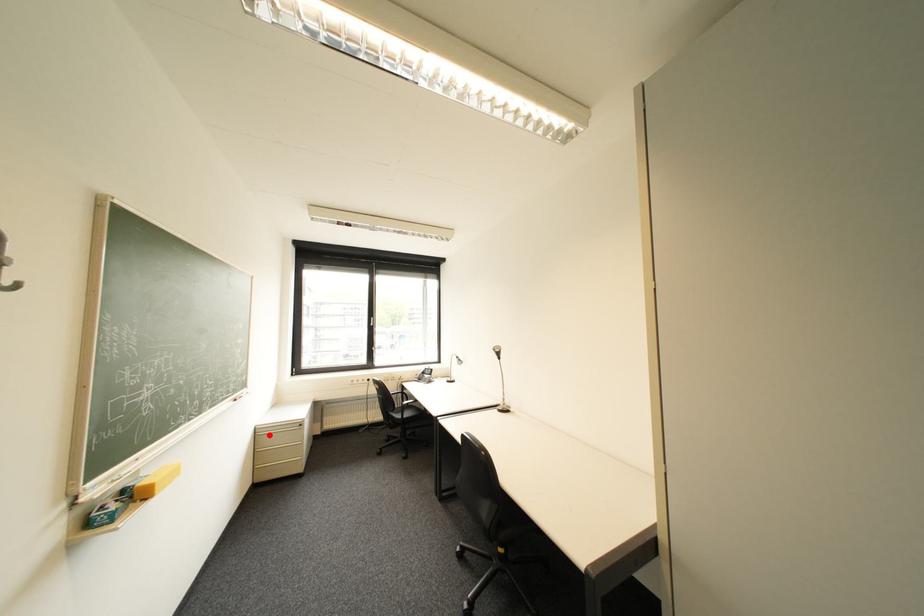
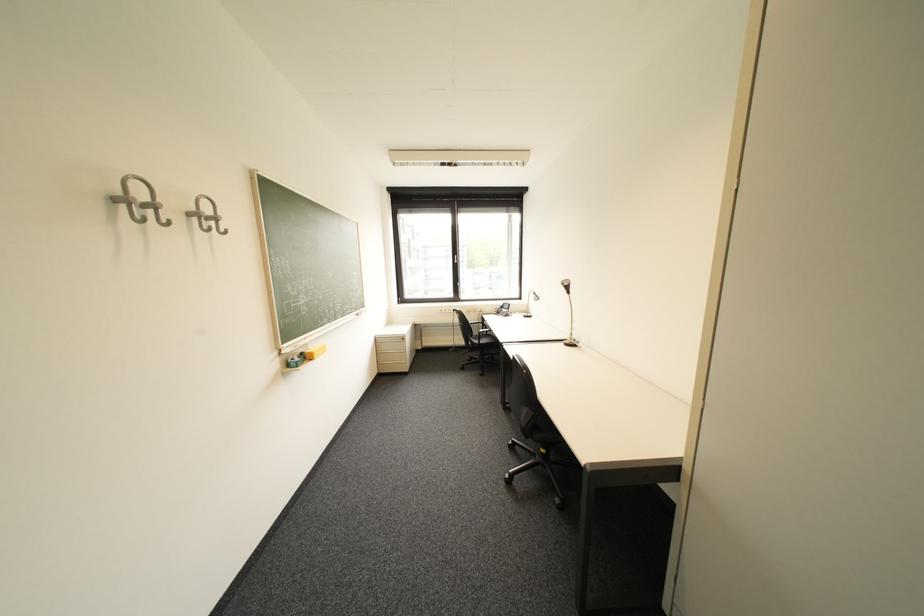
Locate, in the second image, the point that corresponds to the highlighted location in the first image.

(388, 342)